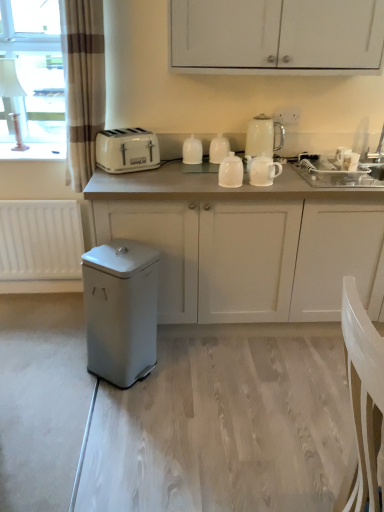
Question: Is white matte cabinet at center, positioned as the 2th cabinetry in top-to-bottom order, bigger than white glossy teapot at center, the 4th kitchen appliance in the left-to-right sequence?

Choices:
 (A) yes
 (B) no

Answer: (A)

Question: Is white matte cabinet at center, which is the first cabinetry from bottom to top, taller than white glossy teapot at center, which is counted as the second kitchen appliance, starting from the right?

Choices:
 (A) no
 (B) yes

Answer: (B)

Question: From a real-world perspective, does white matte cabinet at center, positioned as the 2th cabinetry in top-to-bottom order, sit lower than white glossy teapot at center, the 4th kitchen appliance in the left-to-right sequence?

Choices:
 (A) yes
 (B) no

Answer: (A)

Question: Is the position of white matte cabinet at center, which is the first cabinetry from bottom to top, more distant than that of white glossy teapot at center, which is counted as the second kitchen appliance, starting from the right?

Choices:
 (A) yes
 (B) no

Answer: (B)

Question: Is white matte cabinet at center, which is the first cabinetry from bottom to top, smaller than white glossy teapot at center, which is counted as the second kitchen appliance, starting from the right?

Choices:
 (A) no
 (B) yes

Answer: (A)

Question: Is white matte cabinet at center, which is the first cabinetry from bottom to top, closer to the viewer compared to white glossy teapot at center, which is counted as the second kitchen appliance, starting from the right?

Choices:
 (A) no
 (B) yes

Answer: (B)

Question: From a real-world perspective, does white matte cabinet at center, which is the first cabinetry from bottom to top, stand above white glossy kettle at upper center, marked as the 1th kitchen appliance in a right-to-left arrangement?

Choices:
 (A) yes
 (B) no

Answer: (B)

Question: Is white matte cabinet at center, which is the first cabinetry from bottom to top, to the right of white glossy kettle at upper center, marked as the 1th kitchen appliance in a right-to-left arrangement, from the viewer's perspective?

Choices:
 (A) yes
 (B) no

Answer: (A)

Question: Considering the relative positions of white matte cabinet at center, which is the first cabinetry from bottom to top, and white glossy kettle at upper center, positioned as the 5th kitchen appliance in left-to-right order, in the image provided, is white matte cabinet at center, which is the first cabinetry from bottom to top, in front of white glossy kettle at upper center, positioned as the 5th kitchen appliance in left-to-right order,?

Choices:
 (A) no
 (B) yes

Answer: (B)

Question: Does white matte cabinet at center, positioned as the 2th cabinetry in top-to-bottom order, have a greater height compared to white glossy kettle at upper center, positioned as the 5th kitchen appliance in left-to-right order?

Choices:
 (A) yes
 (B) no

Answer: (A)

Question: Can you confirm if white matte cabinet at center, positioned as the 2th cabinetry in top-to-bottom order, is shorter than white glossy kettle at upper center, marked as the 1th kitchen appliance in a right-to-left arrangement?

Choices:
 (A) yes
 (B) no

Answer: (B)

Question: Is white matte cabinet at center, which is the first cabinetry from bottom to top, thinner than white glossy kettle at upper center, positioned as the 5th kitchen appliance in left-to-right order?

Choices:
 (A) no
 (B) yes

Answer: (A)

Question: Is there a large distance between brown striped curtain at left and white glossy teapot at center, the 4th kitchen appliance in the left-to-right sequence?

Choices:
 (A) yes
 (B) no

Answer: (B)